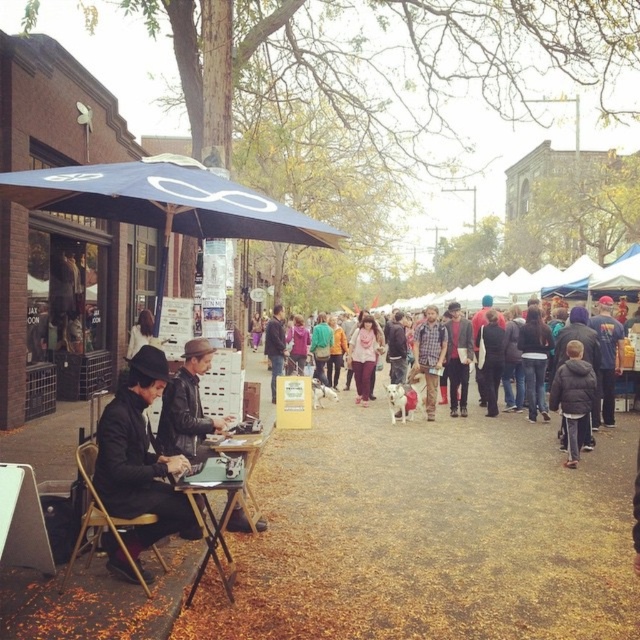
Does navy blue fabric umbrella at upper left have a greater width compared to wooden table at center?

Correct, the width of navy blue fabric umbrella at upper left exceeds that of wooden table at center.

Who is more distant from viewer, (310, 236) or (241, 442)?

Positioned behind is point (241, 442).

Identify the location of navy blue fabric umbrella at upper left. The image size is (640, 640). pos(166,200).

Does navy blue fabric umbrella at upper left appear over black matte laptop at left?

Yes, navy blue fabric umbrella at upper left is above black matte laptop at left.

Between navy blue fabric umbrella at upper left and black matte laptop at left, which one has less height?

With less height is navy blue fabric umbrella at upper left.

Who is more distant from viewer, (x=216, y=211) or (x=93, y=486)?

The point (x=216, y=211) is behind.

I want to click on navy blue fabric umbrella at upper left, so click(166, 200).

Is black matte laptop at left further to the viewer compared to wooden table at center?

No, it is not.

Does point (120, 390) come behind point (224, 451)?

No.

This screenshot has width=640, height=640. Identify the location of black matte laptop at left. (140, 460).